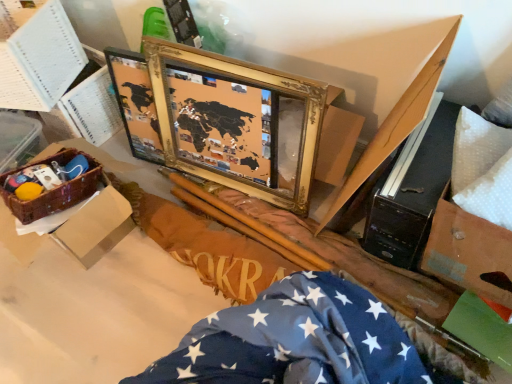
Question: Is the position of gold/gilded picture frame at center less distant than that of blue fabric with white stars at lower right?

Choices:
 (A) yes
 (B) no

Answer: (B)

Question: Does gold/gilded picture frame at center have a greater height compared to blue fabric with white stars at lower right?

Choices:
 (A) yes
 (B) no

Answer: (A)

Question: From the image's perspective, is gold/gilded picture frame at center beneath blue fabric with white stars at lower right?

Choices:
 (A) yes
 (B) no

Answer: (B)

Question: Considering the relative sizes of gold/gilded picture frame at center and blue fabric with white stars at lower right in the image provided, is gold/gilded picture frame at center shorter than blue fabric with white stars at lower right?

Choices:
 (A) no
 (B) yes

Answer: (A)

Question: Is gold/gilded picture frame at center placed right next to blue fabric with white stars at lower right?

Choices:
 (A) no
 (B) yes

Answer: (A)

Question: Does gold/gilded picture frame at center have a larger size compared to blue fabric with white stars at lower right?

Choices:
 (A) no
 (B) yes

Answer: (A)

Question: Does brown woven basket at left, which appears as the first box when ordered from the bottom, lie behind white paper at upper left, which appears as the 2th box when ordered from the bottom?

Choices:
 (A) yes
 (B) no

Answer: (B)

Question: From a real-world perspective, is brown woven basket at left, which appears as the first box when ordered from the bottom, on top of white paper at upper left, positioned as the 1th box in top-to-bottom order?

Choices:
 (A) no
 (B) yes

Answer: (A)

Question: Can you confirm if brown woven basket at left, the 2th box positioned from the top, is bigger than white paper at upper left, which appears as the 2th box when ordered from the bottom?

Choices:
 (A) yes
 (B) no

Answer: (A)

Question: From the image's perspective, is brown woven basket at left, the 2th box positioned from the top, on white paper at upper left, which appears as the 2th box when ordered from the bottom?

Choices:
 (A) no
 (B) yes

Answer: (A)

Question: Can we say brown woven basket at left, the 2th box positioned from the top, lies outside white paper at upper left, which appears as the 2th box when ordered from the bottom?

Choices:
 (A) yes
 (B) no

Answer: (A)

Question: Does brown woven basket at left, which appears as the first box when ordered from the bottom, appear on the left side of white paper at upper left, positioned as the 1th box in top-to-bottom order?

Choices:
 (A) no
 (B) yes

Answer: (A)

Question: From a real-world perspective, is blue fabric with white stars at lower right physically below woven brown basket at lower left?

Choices:
 (A) yes
 (B) no

Answer: (A)